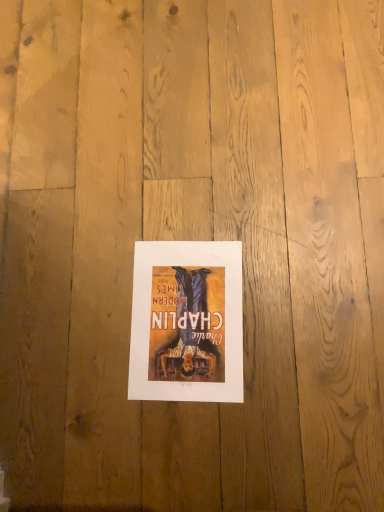
Where is `free space to the left of matte paper poster at center`? The image size is (384, 512). free space to the left of matte paper poster at center is located at coordinates (74, 354).